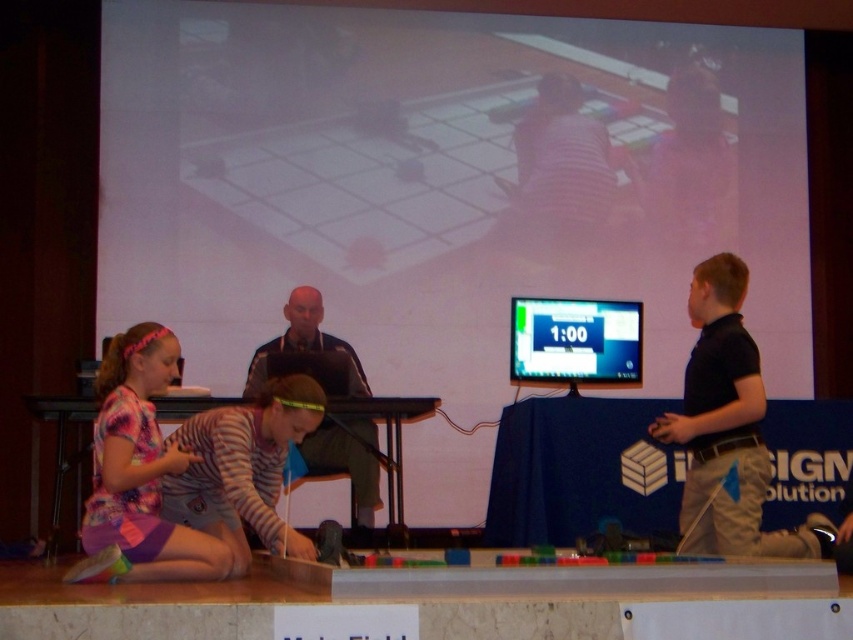
You are a participant in the robotics competition and need to locate your team member wearing the striped jersey at lower left. Where should you look relative to the white matte projection screen at upper center?

The striped jersey at lower left is located below the white matte projection screen at upper center since the screen is positioned over it.

You are a spectator at the robotics competition and want to take a photo of both the white matte projection screen at upper center and the striped jersey at lower left. Can you fit both in your camera frame if the screen is larger?

The white matte projection screen at upper center is larger than the striped jersey at lower left, so yes, both can fit in the camera frame since the screen takes up more space but the jersey is smaller and can be positioned alongside it.